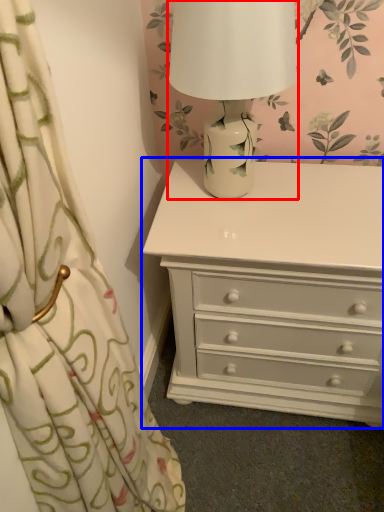
Question: Which point is further to the camera, table lamp (highlighted by a red box) or chest of drawers (highlighted by a blue box)?

Choices:
 (A) table lamp
 (B) chest of drawers

Answer: (B)